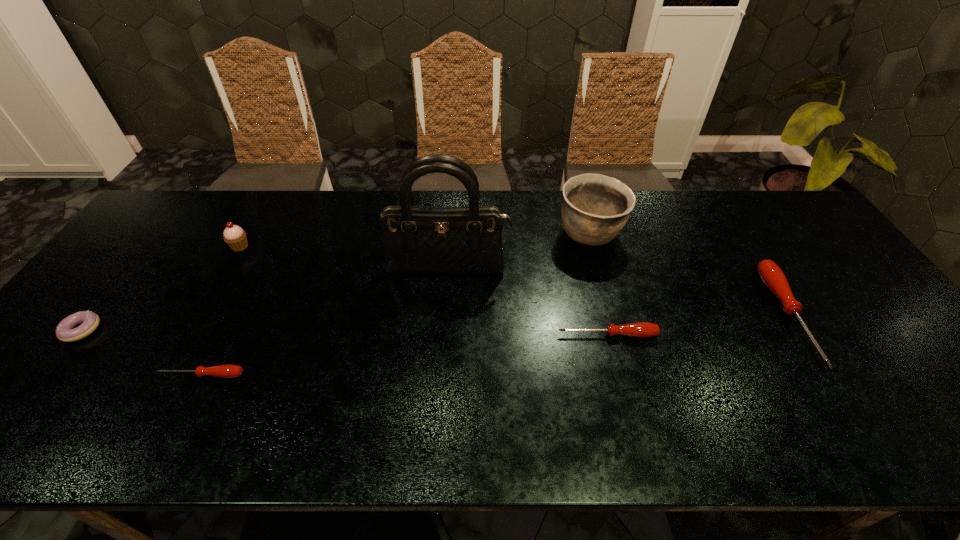
To achieve even spacing by inserting another screwdriver among them, please point to a vacant spot for this new screwdriver. Please provide its 2D coordinates. Your answer should be formatted as a tuple, i.e. [(x, y)], where the tuple contains the x and y coordinates of a point satisfying the conditions above.

[(412, 354)]